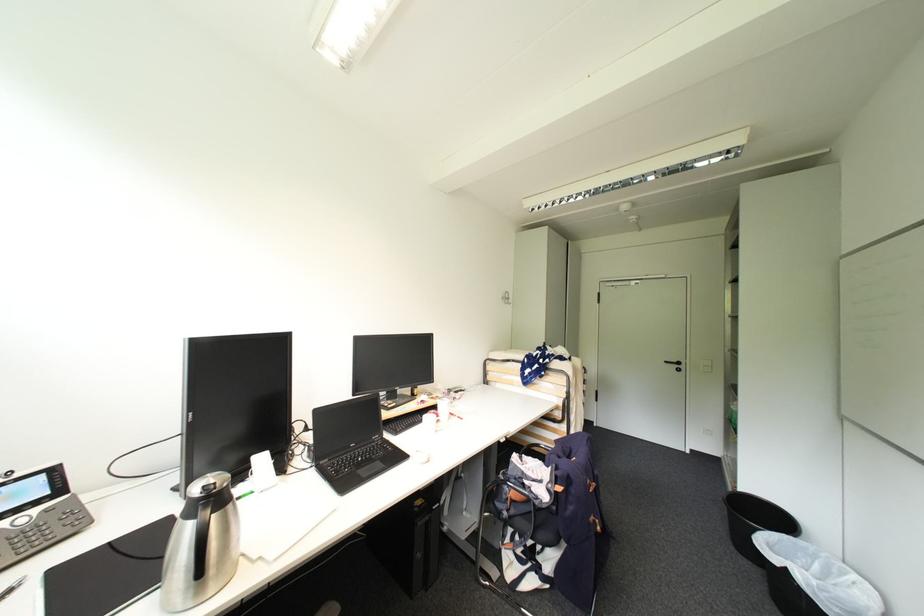
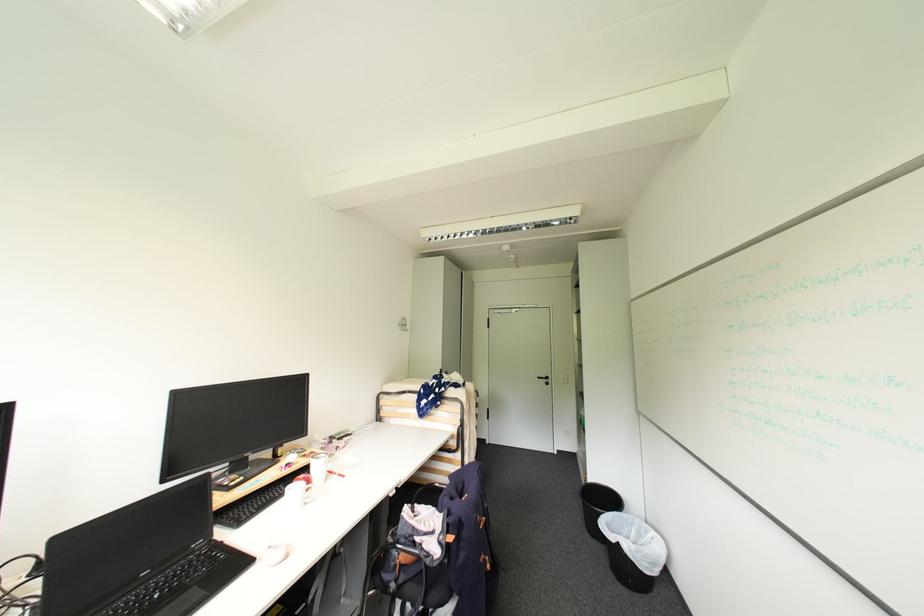
Where in the second image is the point corresponding to (508,299) from the first image?

(406, 325)